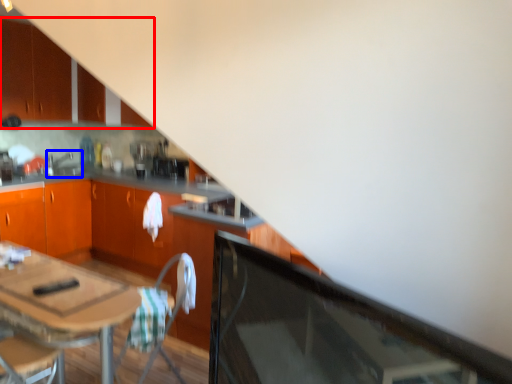
Question: Which object is further to the camera taking this photo, cabinetry (highlighted by a red box) or sink (highlighted by a blue box)?

Choices:
 (A) cabinetry
 (B) sink

Answer: (B)